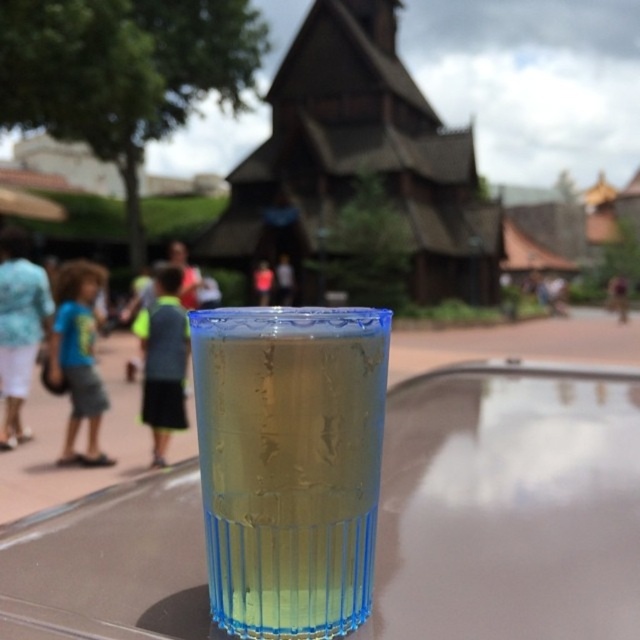
You are standing in the scene and want to walk from the point at coordinates point (300, 404) to the point at coordinates point (17, 332). According to the image, will you be moving towards the background or the foreground?

Point (300, 404) is in front of point (17, 332). Therefore, moving from point (300, 404) to point (17, 332) means you are moving towards the background.

In the scene shown: You are holding a small toy drone that is 3 inches wide. You want to fly it from your current position to the translucent plastic cup at center. Can the drone safely pass between you and the cup without hitting either?

The distance between you and the translucent plastic cup at center is 9.52 inches. Since the drone is 3 inches wide, it can safely pass as long as there is enough vertical clearance. However, the horizontal space is sufficient.

You are at a park and see a translucent plastic cup at center and blue fabric shorts at left. Which object is shorter?

The translucent plastic cup at center is shorter than the blue fabric shorts at left.